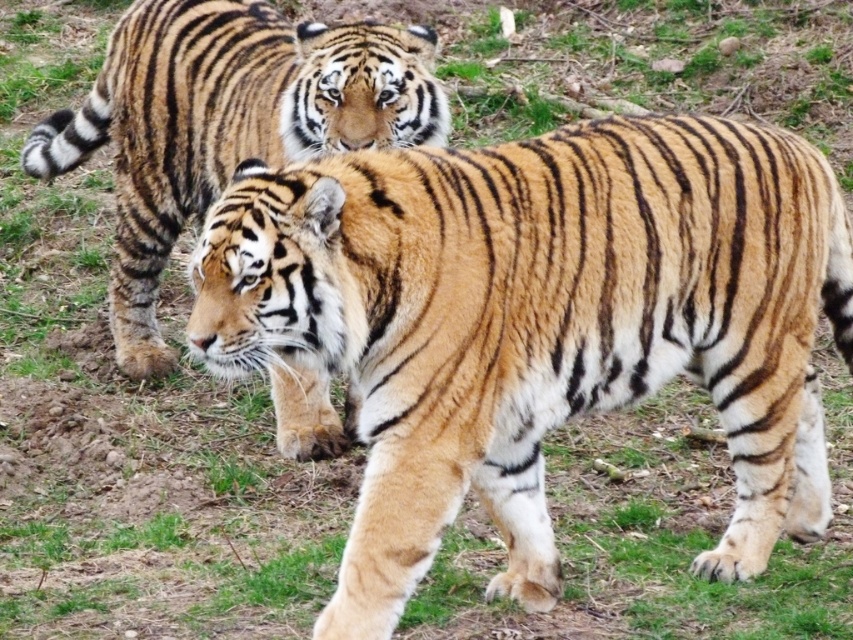
Question: Is golden fur tiger at center positioned before orange-brown fur tiger at center?

Choices:
 (A) yes
 (B) no

Answer: (A)

Question: Among these objects, which one is farthest from the camera?

Choices:
 (A) golden fur tiger at center
 (B) orange-brown fur tiger at center

Answer: (B)

Question: Among these points, which one is nearest to the camera?

Choices:
 (A) (508, 440)
 (B) (158, 266)

Answer: (A)

Question: Is golden fur tiger at center bigger than orange-brown fur tiger at center?

Choices:
 (A) yes
 (B) no

Answer: (B)

Question: Can you confirm if golden fur tiger at center is positioned to the right of orange-brown fur tiger at center?

Choices:
 (A) yes
 (B) no

Answer: (A)

Question: Which point appears farthest from the camera in this image?

Choices:
 (A) (424, 356)
 (B) (202, 179)

Answer: (B)